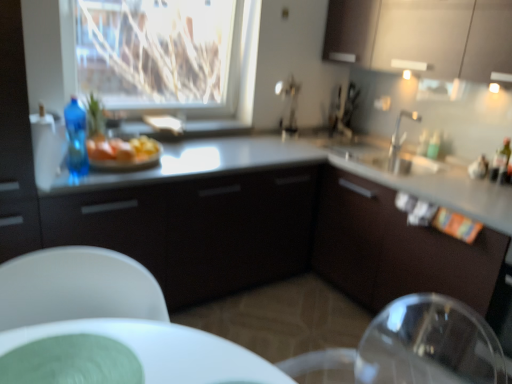
Question: Considering their positions, is matte white cabinets at upper right, which is the 2th cabinetry in left-to-right order, located in front of or behind matte black cabinet at center, the first cabinetry positioned from the left?

Choices:
 (A) front
 (B) behind

Answer: (B)

Question: Does point [x=394, y=23] appear closer or farther from the camera than point [x=200, y=213]?

Choices:
 (A) closer
 (B) farther

Answer: (B)

Question: Which object is the farthest from the matte black cabinet at center, which is the second cabinetry in right-to-left order?

Choices:
 (A) white plastic chair at lower left
 (B) blue plastic bottle at left
 (C) transparent glass window at upper center
 (D) yellow butter at center
 (E) silver metallic faucet at upper right

Answer: (E)

Question: Which object is the closest to the silver metallic faucet at upper right?

Choices:
 (A) matte white cabinets at upper right, which is the 2th cabinetry in left-to-right order
 (B) white plastic chair at lower left
 (C) blue plastic bottle at left
 (D) transparent glass window at upper center
 (E) matte black cabinet at center, the 1th cabinetry positioned from the bottom

Answer: (A)